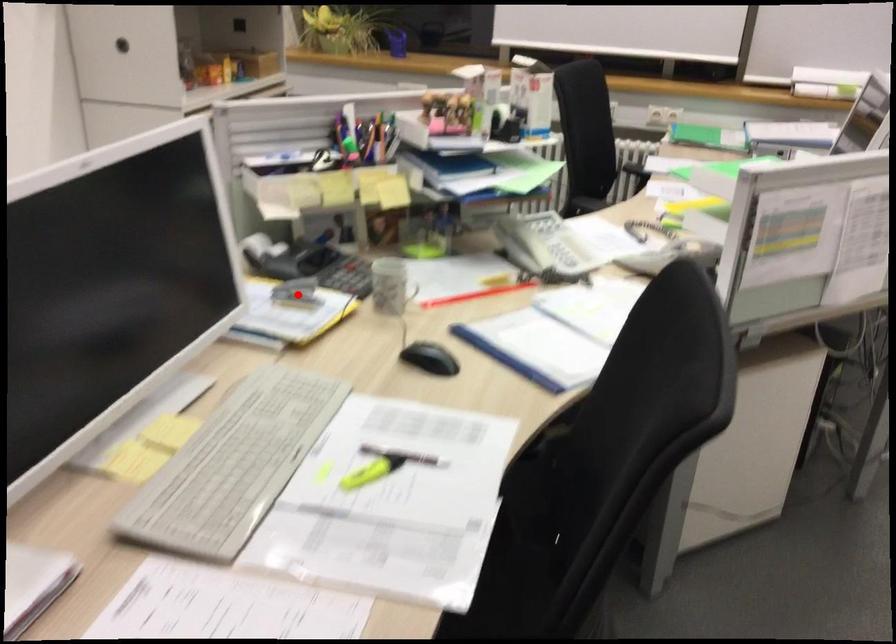
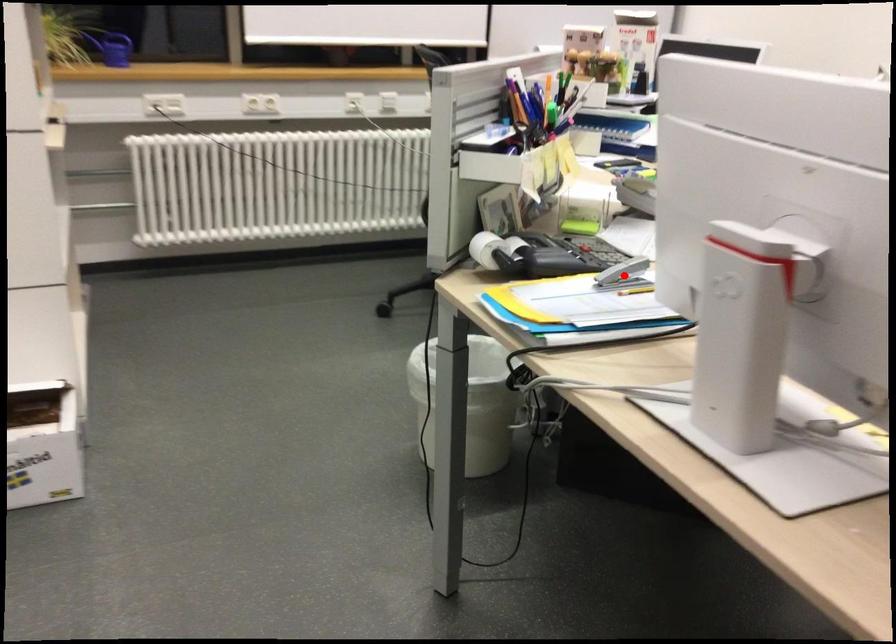
I am providing you with two images of the same scene from different viewpoints. A red point is marked on the first image and another point is marked on the second image. Do the highlighted points in image1 and image2 indicate the same real-world spot?

Yes